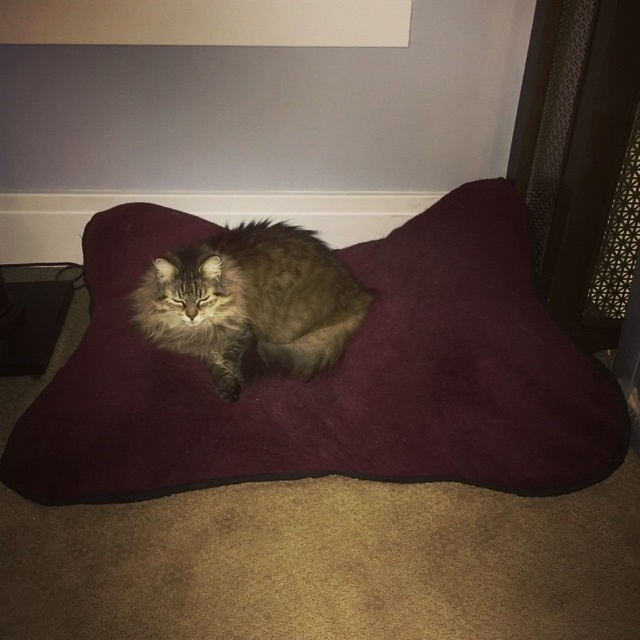
Question: Does burgundy suede cat bed at center appear on the left side of fuzzy brown cat at center?

Choices:
 (A) no
 (B) yes

Answer: (A)

Question: Which object appears farthest from the camera in this image?

Choices:
 (A) fuzzy brown cat at center
 (B) burgundy suede cat bed at center

Answer: (A)

Question: Does burgundy suede cat bed at center appear over fuzzy brown cat at center?

Choices:
 (A) no
 (B) yes

Answer: (A)

Question: Which point is closer to the camera?

Choices:
 (A) (148, 314)
 (B) (452, 400)

Answer: (B)

Question: From the image, what is the correct spatial relationship of burgundy suede cat bed at center in relation to fuzzy brown cat at center?

Choices:
 (A) right
 (B) left

Answer: (A)

Question: Which of the following is the farthest from the observer?

Choices:
 (A) (182, 250)
 (B) (42, 400)

Answer: (A)